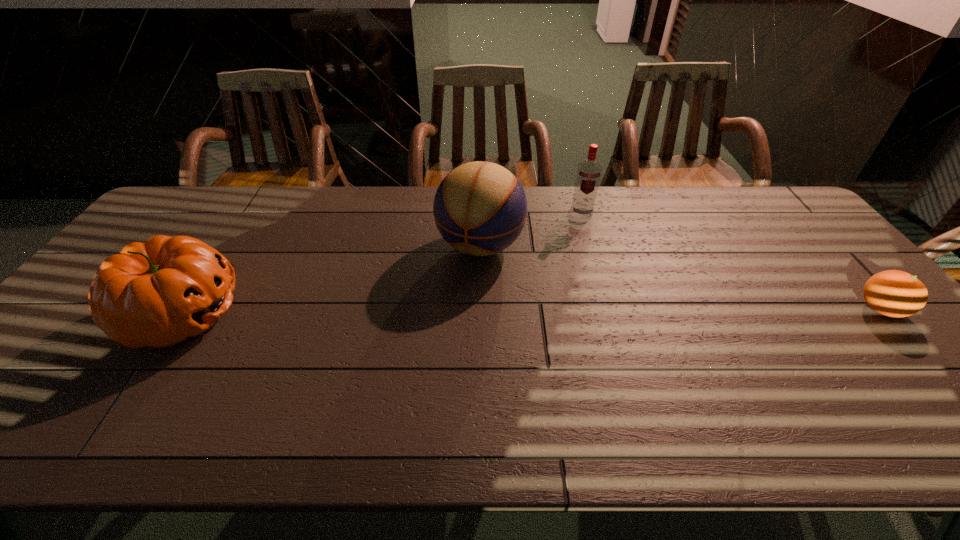
Find the location of `vacant space on the desktop that is between the third tallest object and the orange and is positioned on the front label of the farthest object`. vacant space on the desktop that is between the third tallest object and the orange and is positioned on the front label of the farthest object is located at coordinates click(x=584, y=312).

The height and width of the screenshot is (540, 960). Identify the location of free space on the desktop that is between the leftmost object and the rightmost object and is positioned on the patterned surface of the basketball. (449, 312).